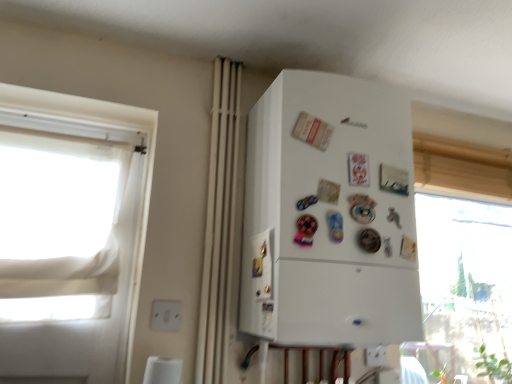
Question: Is white plastic electric outlet at lower left, which is the first electric outlet in top-to-bottom order, bigger or smaller than white plastic electric outlet at lower center, the 1th electric outlet when ordered from back to front?

Choices:
 (A) small
 (B) big

Answer: (A)

Question: Considering the positions of point (160, 309) and point (372, 357), is point (160, 309) closer or farther from the camera than point (372, 357)?

Choices:
 (A) closer
 (B) farther

Answer: (A)

Question: Which is nearer to the white matte refrigerator at center?

Choices:
 (A) white plastic electric outlet at lower left, which is the first electric outlet in top-to-bottom order
 (B) white matte curtain at center
 (C) white plastic electric outlet at lower center, the 2th electric outlet positioned from the front
 (D) white fabric window at left

Answer: (B)

Question: Considering the real-world distances, which object is farthest from the white fabric window at left?

Choices:
 (A) white plastic electric outlet at lower center, which is counted as the 1th electric outlet, starting from the bottom
 (B) white matte refrigerator at center
 (C) white plastic electric outlet at lower left, which is the first electric outlet in top-to-bottom order
 (D) white matte curtain at center

Answer: (A)